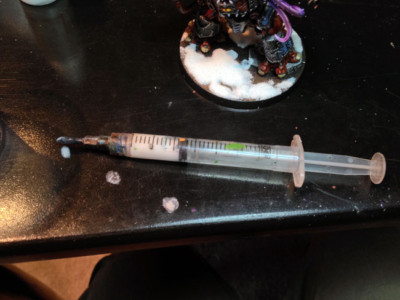
At what (x,y) coordinates should I click in order to perform the action: click on statue. Please return your answer as a coordinate pair (x, y). The image size is (400, 300). Looking at the image, I should click on (246, 21).